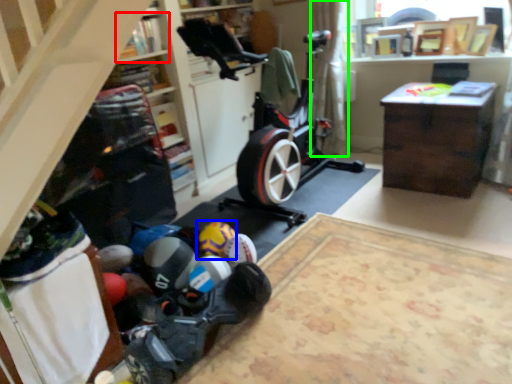
Question: Which object is the closest to the shelf (highlighted by a red box)? Choose among these: toy (highlighted by a blue box) or curtain (highlighted by a green box).

Choices:
 (A) toy
 (B) curtain

Answer: (A)